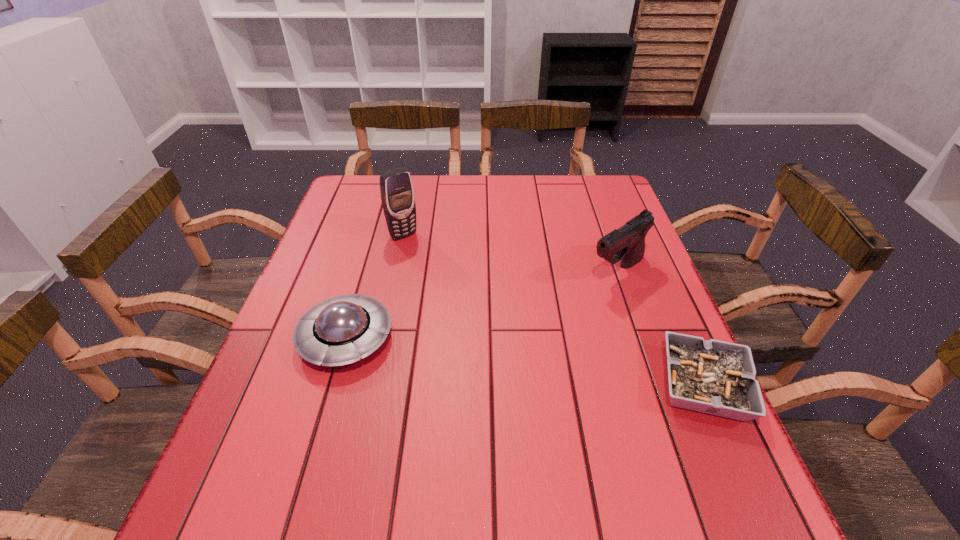
This screenshot has height=540, width=960. Identify the location of vacant space at the near edge of the desktop. (446, 462).

In the image, there is a desktop. Where is `vacant space at the right edge`? The width and height of the screenshot is (960, 540). vacant space at the right edge is located at coordinates (610, 321).

At what (x,y) coordinates should I click in order to perform the action: click on vacant space at the far right corner of the desktop. Please return your answer as a coordinate pair (x, y). Image resolution: width=960 pixels, height=540 pixels. Looking at the image, I should click on (581, 198).

Identify the location of vacant region between the shortest object and the second farthest object. (660, 328).

Locate an element on the screen. free space between the pistol and the second shortest object is located at coordinates (481, 305).

The image size is (960, 540). Identify the location of vacant space in between the farthest object and the second tallest object. (510, 253).

At what (x,y) coordinates should I click in order to perform the action: click on free point between the cellular telephone and the second shortest object. Please return your answer as a coordinate pair (x, y). Looking at the image, I should click on (374, 286).

Where is `vacant space that's between the shortest object and the second farthest object`? The image size is (960, 540). vacant space that's between the shortest object and the second farthest object is located at coordinates (660, 328).

Find the location of `free spot between the pistol and the ashtray`. free spot between the pistol and the ashtray is located at coordinates (660, 328).

The image size is (960, 540). What are the coordinates of `free area in between the saucer and the second farthest object` in the screenshot? It's located at coord(481,305).